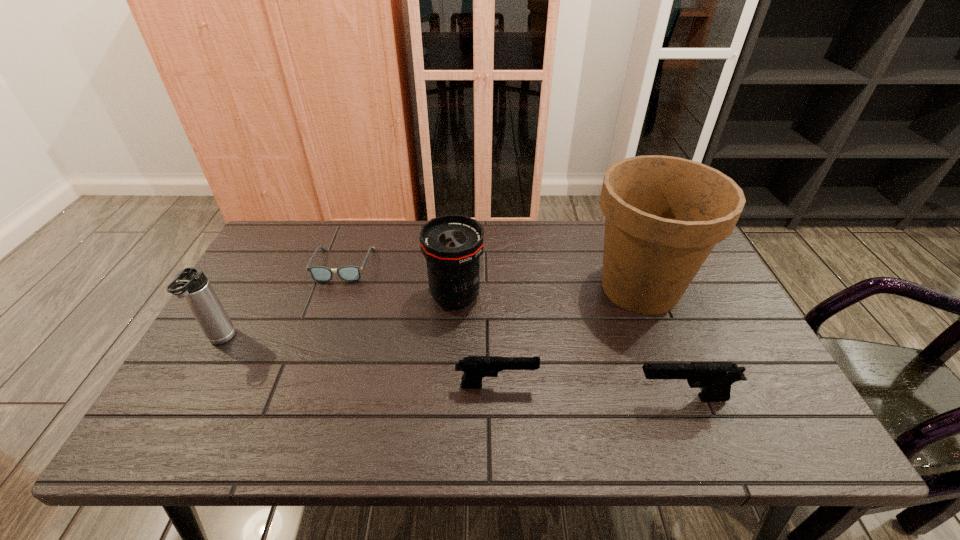
Locate an element on the screen. The height and width of the screenshot is (540, 960). the left pistol is located at coordinates (475, 368).

Locate an element on the screen. The height and width of the screenshot is (540, 960). the farther pistol is located at coordinates (475, 368).

Find the location of a particular element. This screenshot has height=540, width=960. the right pistol is located at coordinates (715, 378).

Identify the location of the nearest object. (715, 378).

This screenshot has height=540, width=960. In order to click on spectacles in this screenshot , I will do `click(319, 273)`.

Image resolution: width=960 pixels, height=540 pixels. In order to click on the fifth object from right to left in this screenshot , I will do `click(319, 273)`.

This screenshot has width=960, height=540. Identify the location of telephoto lens. (452, 244).

Identify the location of the tallest object. Image resolution: width=960 pixels, height=540 pixels. (663, 215).

You are a GUI agent. You are given a task and a screenshot of the screen. Output one action in this format:
    pyautogui.click(x=<x>, y=<y>)
    Task: Click on the thermos bottle
    
    Given the screenshot: What is the action you would take?
    pyautogui.click(x=191, y=283)

The image size is (960, 540). In order to click on vacant region located on the front-facing side of the left pistol in this screenshot , I will do `click(609, 386)`.